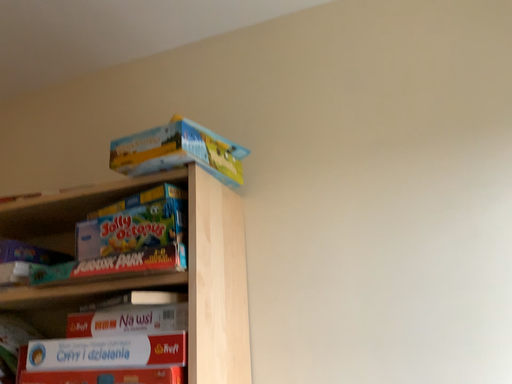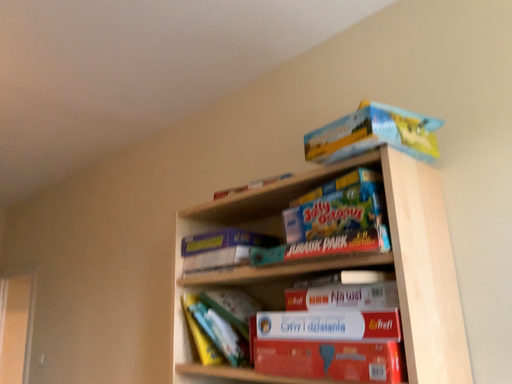
Question: Which way did the camera rotate in the video?

Choices:
 (A) rotated left
 (B) rotated right

Answer: (A)